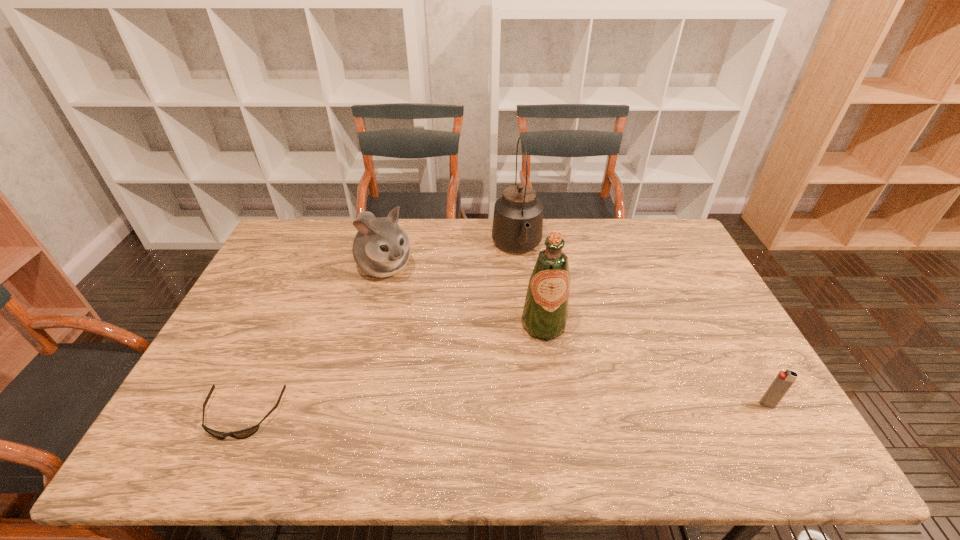
Identify the location of vacant space at the right edge of the desktop. The image size is (960, 540). (696, 297).

Where is `vacant space at the far left corner of the desktop`? The image size is (960, 540). vacant space at the far left corner of the desktop is located at coordinates (316, 237).

The height and width of the screenshot is (540, 960). I want to click on vacant area at the near left corner, so click(x=235, y=412).

The image size is (960, 540). Identify the location of free space that is in between the fourth shortest object and the leftmost object. (393, 370).

Where is `empty space that is in between the igniter and the kettle`? empty space that is in between the igniter and the kettle is located at coordinates (642, 326).

At what (x,y) coordinates should I click in order to perform the action: click on vacant point located between the fourth tallest object and the third nearest object. Please return your answer as a coordinate pair (x, y). Image resolution: width=960 pixels, height=540 pixels. Looking at the image, I should click on (656, 365).

At what (x,y) coordinates should I click in order to perform the action: click on unoccupied position between the tallest object and the leftmost object. Please return your answer as a coordinate pair (x, y). Looking at the image, I should click on (380, 331).

Identify the location of free spot between the fourth object from right to left and the sunglasses. The height and width of the screenshot is (540, 960). (314, 341).

At what (x,y) coordinates should I click in order to perform the action: click on free area in between the hamster and the leftmost object. Please return your answer as a coordinate pair (x, y). The height and width of the screenshot is (540, 960). Looking at the image, I should click on (314, 341).

The image size is (960, 540). Find the location of `vacant space in between the third shortest object and the kettle`. vacant space in between the third shortest object and the kettle is located at coordinates (451, 257).